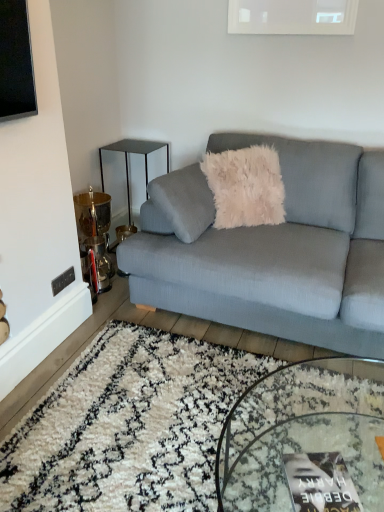
You are a GUI agent. You are given a task and a screenshot of the screen. Output one action in this format:
    pyautogui.click(x=<x>, y=<y>)
    Task: Click on the clear glass coffee table at center
    The width and height of the screenshot is (384, 512).
    Given the screenshot: What is the action you would take?
    pyautogui.click(x=302, y=432)

I want to click on matte black magazine at lower center, so click(x=320, y=483).

How many degrees apart are the facing directions of clear glass coffee table at center and metallic black side table at upper left?

clear glass coffee table at center and metallic black side table at upper left are facing 2.89 degrees away from each other.

From the picture: In terms of width, does clear glass coffee table at center look wider or thinner when compared to metallic black side table at upper left?

Clearly, clear glass coffee table at center has more width compared to metallic black side table at upper left.

From the image's perspective, which is below, clear glass coffee table at center or metallic black side table at upper left?

clear glass coffee table at center.

Is clear glass coffee table at center aimed at metallic black side table at upper left?

No, clear glass coffee table at center is not turned towards metallic black side table at upper left.

Is textured gray couch at center next to metallic black side table at upper left?

No, textured gray couch at center is not touching metallic black side table at upper left.

Considering the sizes of objects textured gray couch at center and metallic black side table at upper left in the image provided, who is shorter, textured gray couch at center or metallic black side table at upper left?

metallic black side table at upper left.

Based on the photo, does textured gray couch at center contain metallic black side table at upper left?

Definitely not — metallic black side table at upper left is not inside textured gray couch at center.

Considering the relative sizes of textured gray couch at center and metallic black side table at upper left in the image provided, is textured gray couch at center thinner than metallic black side table at upper left?

Incorrect, the width of textured gray couch at center is not less than that of metallic black side table at upper left.

Which object is positioned more to the right, clear glass coffee table at center or textured gray couch at center?

textured gray couch at center is more to the right.

From the image's perspective, is clear glass coffee table at center located beneath textured gray couch at center?

Indeed, from the image's perspective, clear glass coffee table at center is shown beneath textured gray couch at center.

Measure the distance between clear glass coffee table at center and textured gray couch at center.

The distance of clear glass coffee table at center from textured gray couch at center is 24.83 inches.

Is clear glass coffee table at center oriented away from textured gray couch at center?

No.

Could you tell me if matte black magazine at lower center is turned towards textured gray couch at center?

No.

Between matte black magazine at lower center and textured gray couch at center, which one is positioned behind?

Positioned behind is textured gray couch at center.

Considering the sizes of matte black magazine at lower center and textured gray couch at center in the image, is matte black magazine at lower center wider or thinner than textured gray couch at center?

Clearly, matte black magazine at lower center has less width compared to textured gray couch at center.

Considering the positions of point (330, 503) and point (361, 308), is point (330, 503) closer or farther from the camera than point (361, 308)?

Point (330, 503) is positioned closer to the camera compared to point (361, 308).

From a real-world perspective, is matte black magazine at lower center positioned over metallic black side table at upper left based on gravity?

No, from a real-world perspective, matte black magazine at lower center is not above metallic black side table at upper left.

How different are the orientations of matte black magazine at lower center and metallic black side table at upper left in degrees?

They differ by 24.8 degrees in their facing directions.

In the image, is matte black magazine at lower center positioned in front of or behind metallic black side table at upper left?

In the image, matte black magazine at lower center appears in front of metallic black side table at upper left.

Is matte black magazine at lower center spatially inside metallic black side table at upper left, or outside of it?

matte black magazine at lower center is not enclosed by metallic black side table at upper left.

Is textured gray couch at center inside or outside of matte black magazine at lower center?

textured gray couch at center is outside matte black magazine at lower center.

Which of these two, textured gray couch at center or matte black magazine at lower center, is thinner?

matte black magazine at lower center is thinner.

From the image's perspective, is textured gray couch at center over matte black magazine at lower center?

Correct, textured gray couch at center appears higher than matte black magazine at lower center in the image.

From the image's perspective, which object appears higher, metallic black side table at upper left or clear glass coffee table at center?

metallic black side table at upper left appears higher in the image.

From a real-world perspective, does metallic black side table at upper left stand above clear glass coffee table at center?

→ Yes, from a real-world perspective, metallic black side table at upper left is over clear glass coffee table at center

In terms of width, does metallic black side table at upper left look wider or thinner when compared to clear glass coffee table at center?

Clearly, metallic black side table at upper left has less width compared to clear glass coffee table at center.

Looking at this image, is the depth of metallic black side table at upper left greater than that of clear glass coffee table at center?

Yes, metallic black side table at upper left is further from the camera.

In order to click on coffee table in front of the metallic black side table at upper left in this screenshot , I will do `click(302, 432)`.

You are a GUI agent. You are given a task and a screenshot of the screen. Output one action in this format:
    pyautogui.click(x=<x>, y=<y>)
    Task: Click on the table on the left side of textured gray couch at center
    This screenshot has height=512, width=384.
    Given the screenshot: What is the action you would take?
    pyautogui.click(x=128, y=172)

Considering their positions, is clear glass coffee table at center positioned further to metallic black side table at upper left than textured gray couch at center?

Among the two, clear glass coffee table at center is located further to metallic black side table at upper left.

Considering their positions, is matte black magazine at lower center positioned further to clear glass coffee table at center than metallic black side table at upper left?

metallic black side table at upper left lies further to clear glass coffee table at center than the other object.

Based on their spatial positions, is clear glass coffee table at center or textured gray couch at center closer to matte black magazine at lower center?

The object closer to matte black magazine at lower center is clear glass coffee table at center.

Looking at the image, which one is located further to metallic black side table at upper left, textured gray couch at center or matte black magazine at lower center?

Based on the image, matte black magazine at lower center appears to be further to metallic black side table at upper left.

Considering their positions, is clear glass coffee table at center positioned further to textured gray couch at center than matte black magazine at lower center?

matte black magazine at lower center is positioned further to the anchor textured gray couch at center.

Looking at the image, which one is located further to textured gray couch at center, matte black magazine at lower center or metallic black side table at upper left?

matte black magazine at lower center is positioned further to the anchor textured gray couch at center.

Considering their positions, is clear glass coffee table at center positioned further to textured gray couch at center than metallic black side table at upper left?

The object further to textured gray couch at center is metallic black side table at upper left.

Estimate the real-world distances between objects in this image. Which object is closer to metallic black side table at upper left, matte black magazine at lower center or textured gray couch at center?

Based on the image, textured gray couch at center appears to be nearer to metallic black side table at upper left.

Locate an element on the screen. The image size is (384, 512). magazine between textured gray couch at center and clear glass coffee table at center from top to bottom is located at coordinates (320, 483).

Find the location of `studio couch between clear glass coffee table at center and metallic black side table at upper left from front to back`. studio couch between clear glass coffee table at center and metallic black side table at upper left from front to back is located at coordinates (274, 250).

In order to click on studio couch between matte black magazine at lower center and metallic black side table at upper left from front to back in this screenshot , I will do `click(274, 250)`.

In order to click on magazine between clear glass coffee table at center and metallic black side table at upper left in the front-back direction in this screenshot , I will do [320, 483].